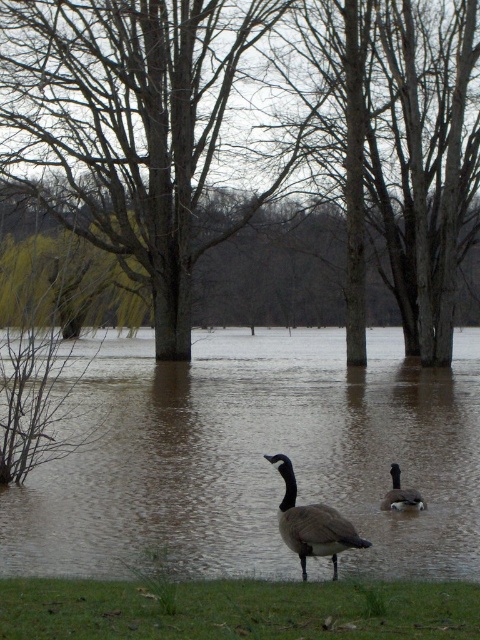
Question: Can you confirm if green grass at lower center is positioned above dark gray matte duck at center?

Choices:
 (A) no
 (B) yes

Answer: (B)

Question: Which point appears closest to the camera in this image?

Choices:
 (A) (219, 513)
 (B) (294, 502)
 (C) (475, 600)

Answer: (C)

Question: Is green grass at lower center further to the viewer compared to dark gray matte duck at center?

Choices:
 (A) no
 (B) yes

Answer: (A)

Question: Which of the following is the closest to the observer?

Choices:
 (A) green grass at lower center
 (B) gray matte goose at center
 (C) brown bark tree at center

Answer: (A)

Question: Can you confirm if brown murky water at center is positioned to the right of green grass at lower center?

Choices:
 (A) no
 (B) yes

Answer: (B)

Question: Among these points, which one is nearest to the camera?

Choices:
 (A) (395, 506)
 (B) (260, 611)
 (C) (331, 536)
 (D) (99, 220)

Answer: (B)